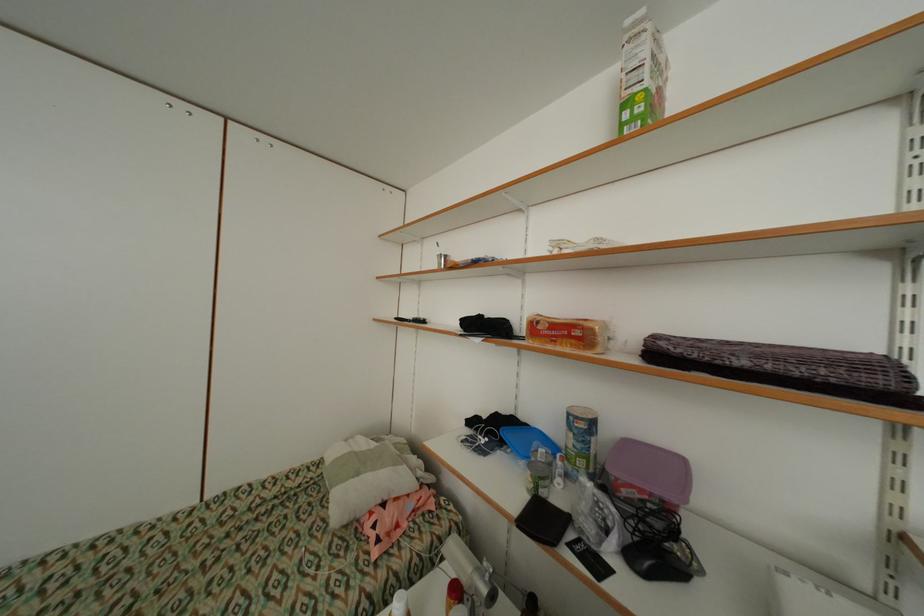
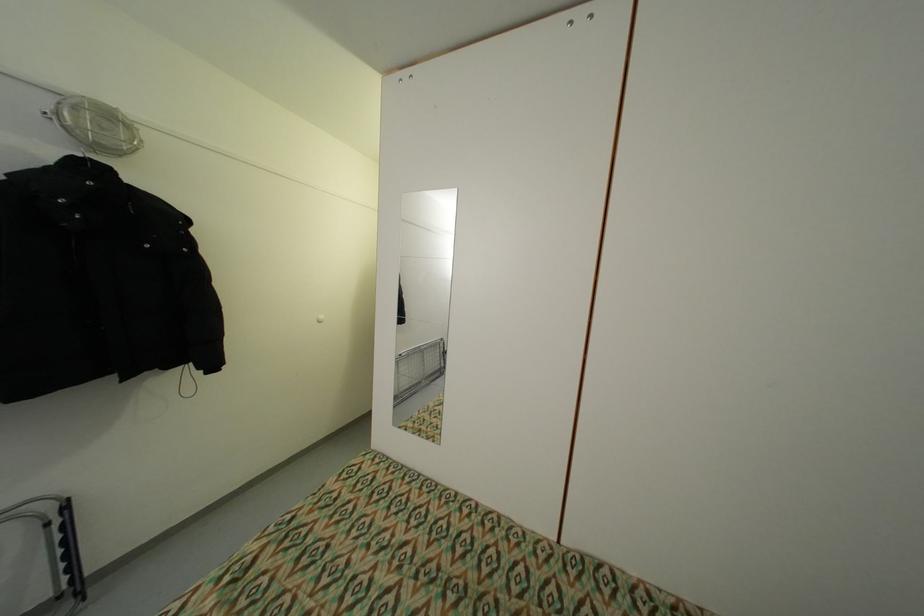
Question: The first image is from the beginning of the video and the second image is from the end. How did the camera likely rotate when shooting the video?

Choices:
 (A) Left
 (B) Right
 (C) Up
 (D) Down

Answer: (A)